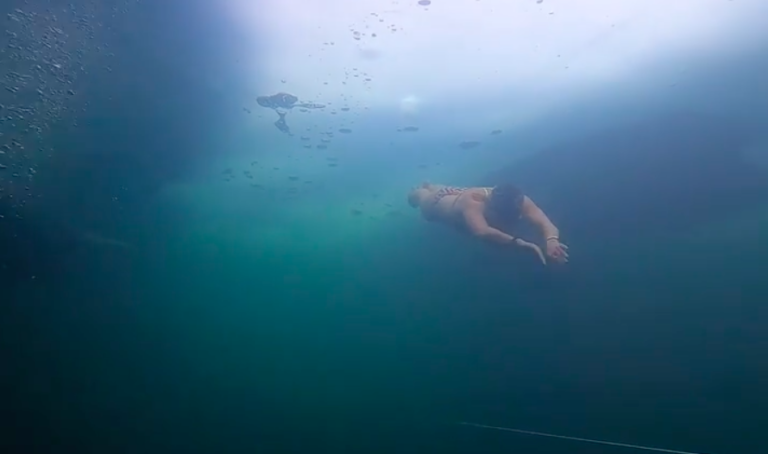
At what (x,y) coordinates should I click in order to perform the action: click on light. Please return your answer as a coordinate pair (x, y). The image size is (768, 454). Looking at the image, I should click on (402, 47).